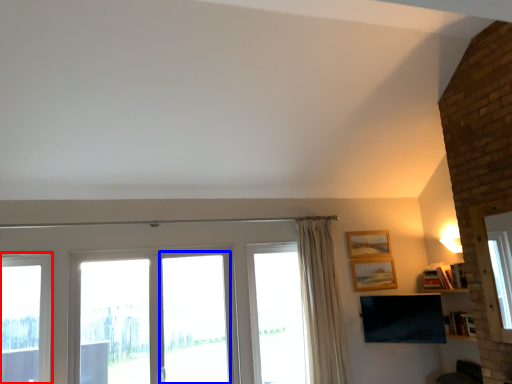
Question: Among these objects, which one is nearest to the camera, window (highlighted by a red box) or screen door (highlighted by a blue box)?

Choices:
 (A) window
 (B) screen door

Answer: (A)